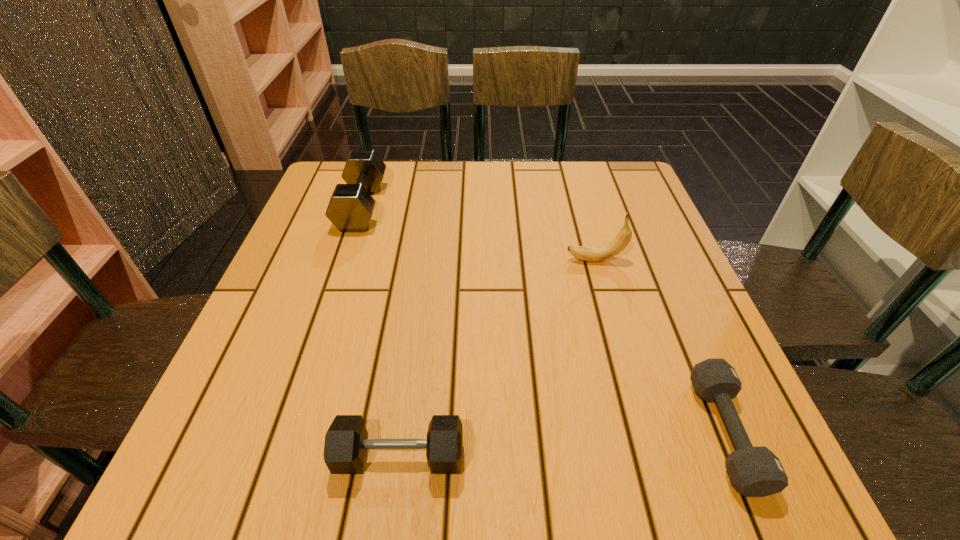
At what (x,y) coordinates should I click in order to perform the action: click on free region located at the start of the peel on the third object from left to right. Please return your answer as a coordinate pair (x, y). The image size is (960, 540). Looking at the image, I should click on (488, 260).

The width and height of the screenshot is (960, 540). Find the location of `free space located 0.310m on the front of the tallest dumbbell`. free space located 0.310m on the front of the tallest dumbbell is located at coordinates (318, 339).

Where is `vacant area situated on the back of the second dumbbell from right to left`? The image size is (960, 540). vacant area situated on the back of the second dumbbell from right to left is located at coordinates (408, 394).

At what (x,y) coordinates should I click in order to perform the action: click on blank space located 0.190m on the left of the shortest dumbbell. Please return your answer as a coordinate pair (x, y). This screenshot has height=540, width=960. Looking at the image, I should click on (581, 433).

Locate an element on the screen. Image resolution: width=960 pixels, height=540 pixels. object situated at the far edge is located at coordinates (350, 208).

This screenshot has width=960, height=540. What are the coordinates of `object that is at the left edge` in the screenshot? It's located at (x=350, y=208).

Find the location of a particular element. This screenshot has height=540, width=960. banana located at the right edge is located at coordinates [592, 254].

You are a GUI agent. You are given a task and a screenshot of the screen. Output one action in this format:
    pyautogui.click(x=<x>, y=<y>)
    Task: Click on the dumbbell that is positioned at the right edge
    The image size is (960, 540).
    Given the screenshot: What is the action you would take?
    pyautogui.click(x=756, y=471)

At what (x,y) coordinates should I click in order to perform the action: click on object that is at the far left corner. Please return your answer as a coordinate pair (x, y). The width and height of the screenshot is (960, 540). Looking at the image, I should click on (350, 208).

I want to click on object that is at the near right corner, so click(756, 471).